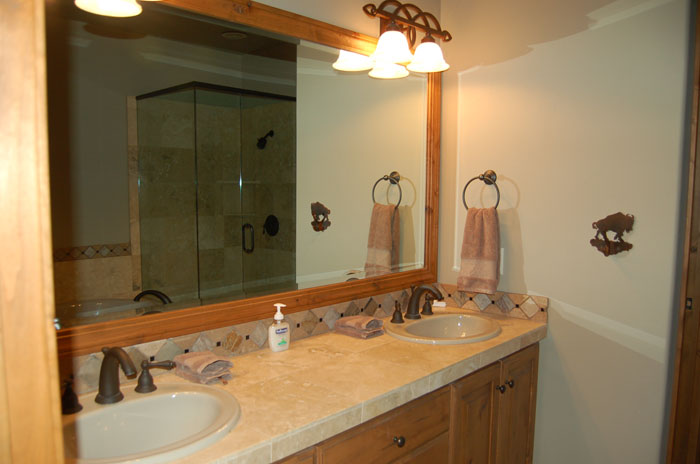
At what (x,y) coordinates should I click in order to perform the action: click on water faucet. Please return your answer as a coordinate pair (x, y). The image size is (700, 464). Looking at the image, I should click on (108, 371), (416, 295).